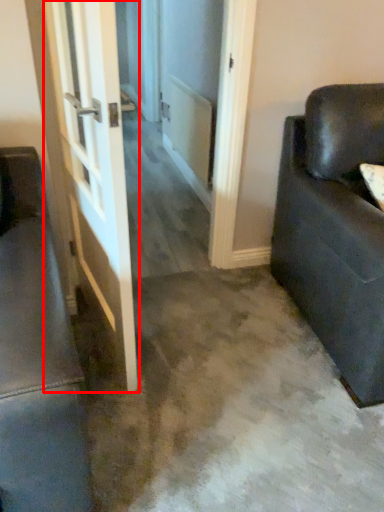
Question: Considering the relative positions of door (annotated by the red box) and studio couch in the image provided, where is door (annotated by the red box) located with respect to the staircase?

Choices:
 (A) left
 (B) right

Answer: (A)